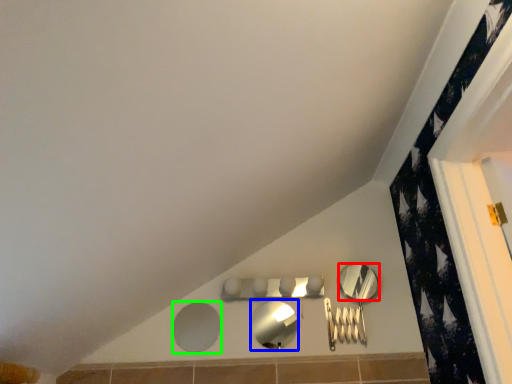
Question: Which object is positioned farthest from mirror (highlighted by a red box)? Select from mirror (highlighted by a blue box) and mirror (highlighted by a green box).

Choices:
 (A) mirror
 (B) mirror

Answer: (B)